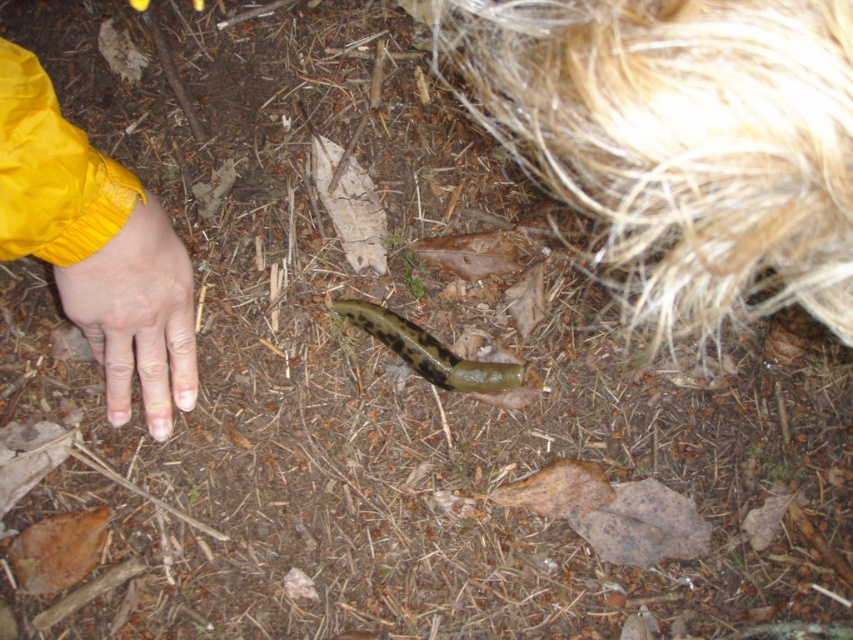
Question: Which object is the closest to the yellow fabric hand at lower left?

Choices:
 (A) yellow matte hand at lower left
 (B) green slimy slug at center

Answer: (A)

Question: Can you confirm if yellow fabric hand at lower left is positioned above green slimy slug at center?

Choices:
 (A) yes
 (B) no

Answer: (A)

Question: Is yellow fabric hand at lower left bigger than yellow matte hand at lower left?

Choices:
 (A) no
 (B) yes

Answer: (B)

Question: Does yellow fabric hand at lower left come behind green slimy slug at center?

Choices:
 (A) yes
 (B) no

Answer: (B)

Question: Which point is farther from the camera taking this photo?

Choices:
 (A) (109, 362)
 (B) (403, 330)
 (C) (144, 340)

Answer: (B)

Question: Among these points, which one is farthest from the camera?

Choices:
 (A) (49, 186)
 (B) (467, 376)
 (C) (126, 384)

Answer: (B)